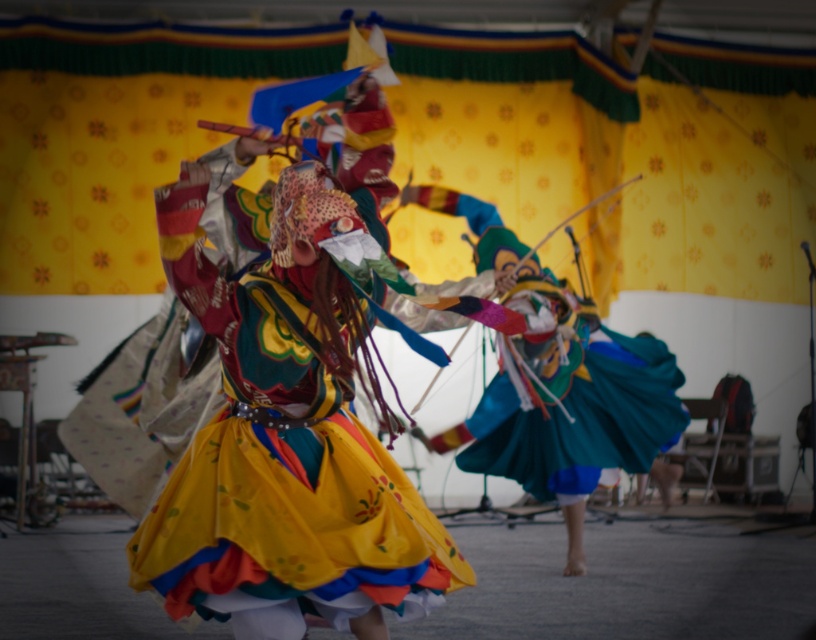
Question: Does multicolored fabric costume at center appear under teal satin skirt at center?

Choices:
 (A) no
 (B) yes

Answer: (B)

Question: Which of the following is the farthest from the observer?

Choices:
 (A) (282, 304)
 (B) (520, 417)

Answer: (B)

Question: Is multicolored fabric costume at center wider than teal satin skirt at center?

Choices:
 (A) yes
 (B) no

Answer: (B)

Question: Does multicolored fabric costume at center have a lesser width compared to teal satin skirt at center?

Choices:
 (A) yes
 (B) no

Answer: (A)